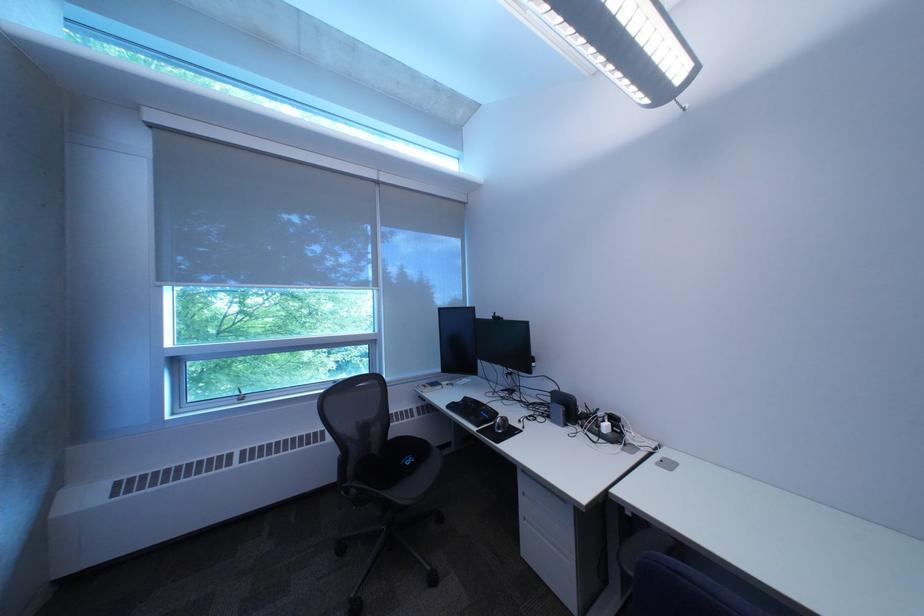
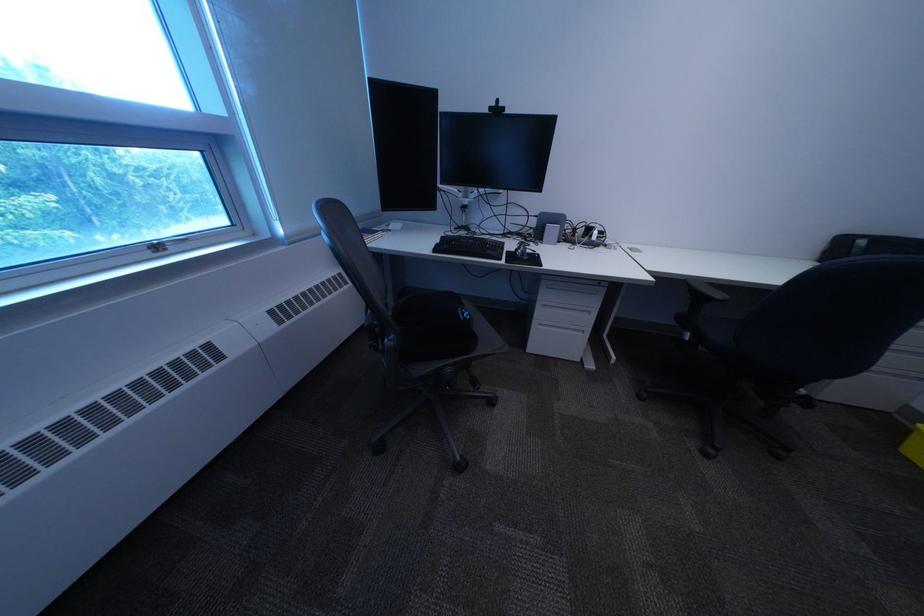
Where in the second image is the point corresponding to the point at 464,408 from the first image?

(451, 252)